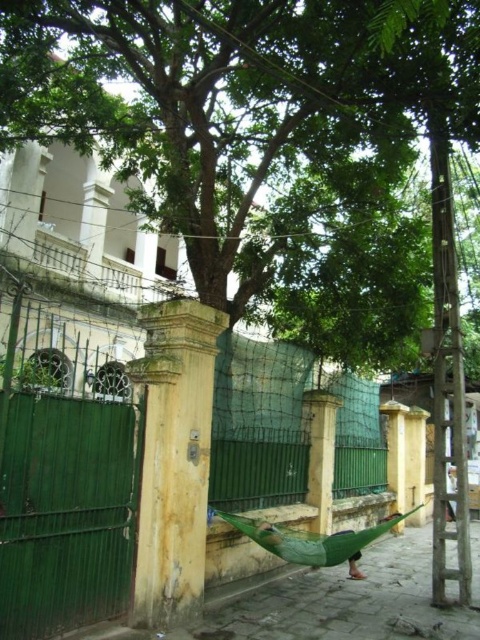
You are standing at the base of the green leafy tree at center and want to hang a birdhouse on one of its branches. The birdhouse requires a minimum of 4 meters of clearance from the ground to ensure birds feel safe. Can you safely hang the birdhouse on the tree?

The distance between the base of the green leafy tree at center and the lowest branch is 3.99 meters, which is just below the required 4 meters. Therefore, you cannot safely hang the birdhouse on the tree as it does not meet the minimum clearance requirement.

You are standing in the courtyard and want to place a small potted plant between the two points labeled point [288,20] and point [239,468]. Which point should you place it closer to so that the plant is nearer to the viewer?

You should place the small potted plant closer to point [288,20] because it is closer to the viewer than point [239,468].

Looking at this image, you are a painter standing in the courtyard and want to paint the green leafy tree at center and the green metal fence at center. Which object should you stand closer to in order to capture their full height in your painting?

The green leafy tree at center is taller than the green metal fence at center, so you should stand closer to the green metal fence at center to ensure both objects can be fully captured in your painting.